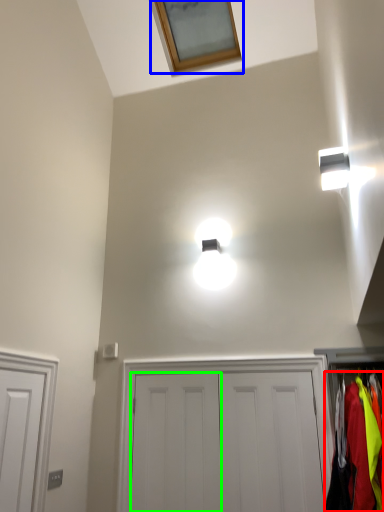
Question: Which object is the closest to the clothing (highlighted by a red box)? Choose among these: window (highlighted by a blue box) or door (highlighted by a green box).

Choices:
 (A) window
 (B) door

Answer: (B)